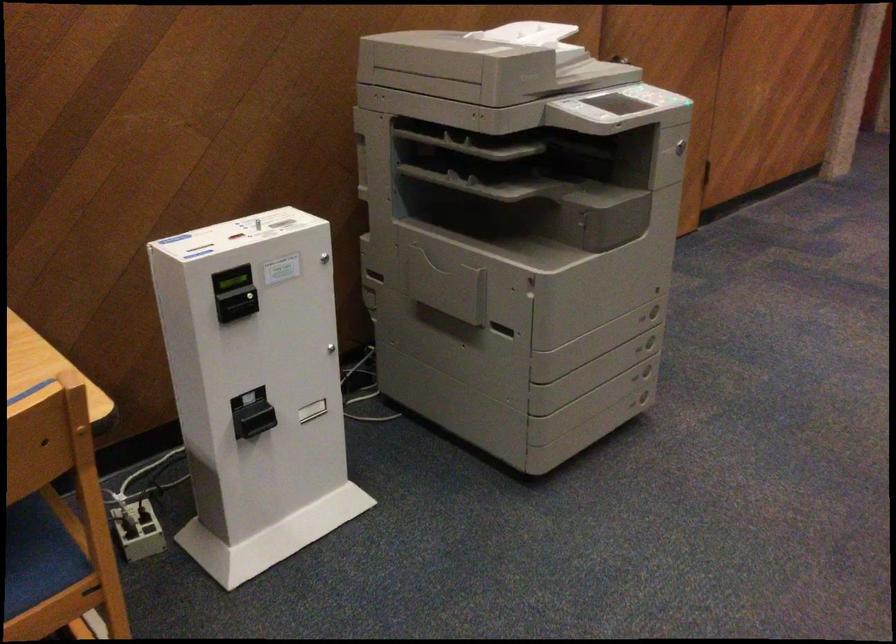
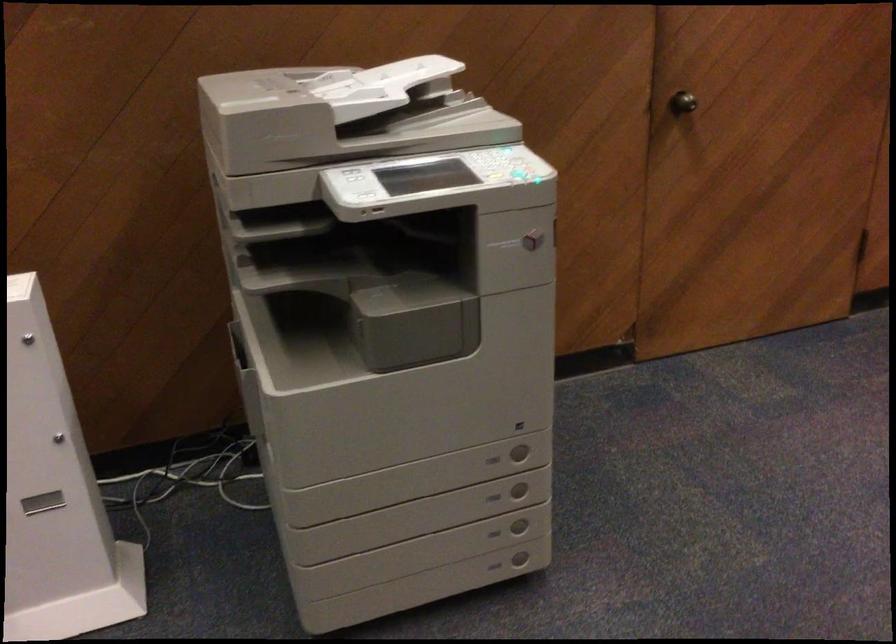
Where in the second image is the point corresponding to [650,342] from the first image?

(519, 489)